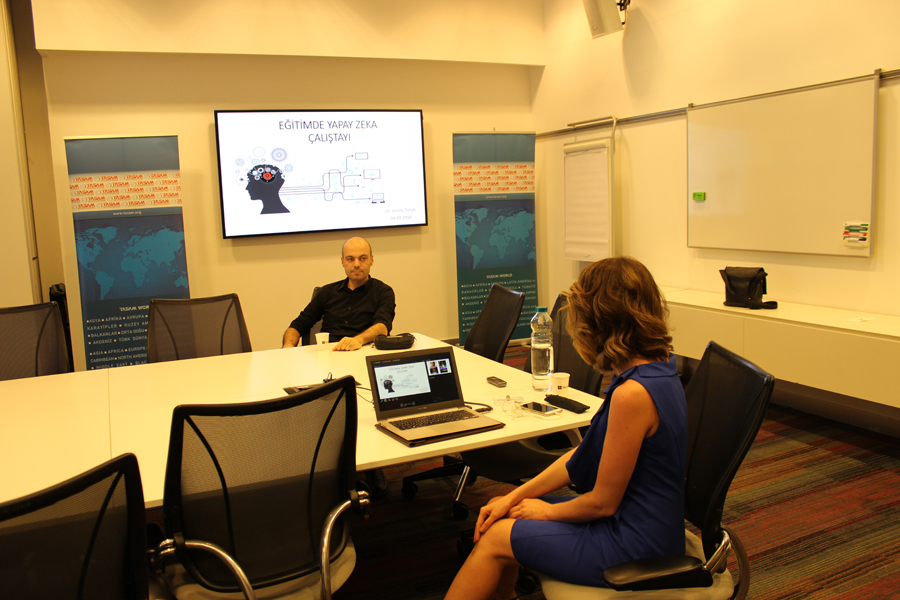
Where is `1 water bottle`? This screenshot has width=900, height=600. 1 water bottle is located at coordinates (554, 353).